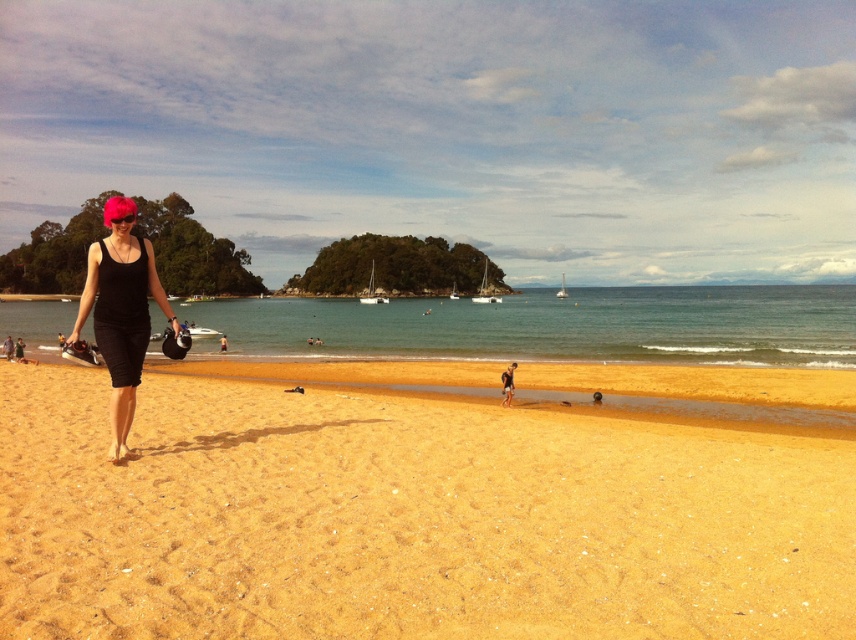
Who is more forward, (501, 378) or (6, 349)?

Point (501, 378)

Is light brown sand at lower center wider than black matte tank top at left?

No, light brown sand at lower center is not wider than black matte tank top at left.

Where is `light brown sand at lower center`? light brown sand at lower center is located at coordinates (x=507, y=384).

Is golden sand at lower left wider than clear blue water at center?

No.

Does point (180, 488) lie behind point (678, 323)?

No, (180, 488) is in front of (678, 323).

Is point (417, 460) positioned in front of point (204, 317)?

Yes.

Find the location of `golden sand at lower left`. golden sand at lower left is located at coordinates (407, 518).

Can you confirm if golden sand at lower left is thinner than black matte swimsuit at left?

In fact, golden sand at lower left might be wider than black matte swimsuit at left.

Is golden sand at lower left wider than black matte swimsuit at left?

Yes, golden sand at lower left is wider than black matte swimsuit at left.

This screenshot has width=856, height=640. I want to click on golden sand at lower left, so click(x=407, y=518).

The image size is (856, 640). What are the coordinates of `golden sand at lower left` in the screenshot? It's located at (407, 518).